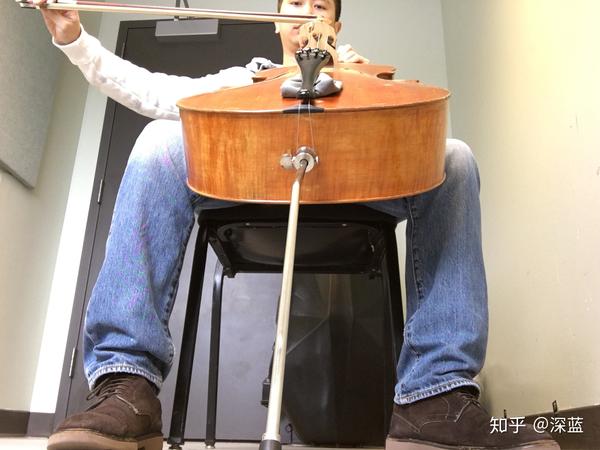
Find the location of a particular element. The width and height of the screenshot is (600, 450). metal door is located at coordinates (209, 52).